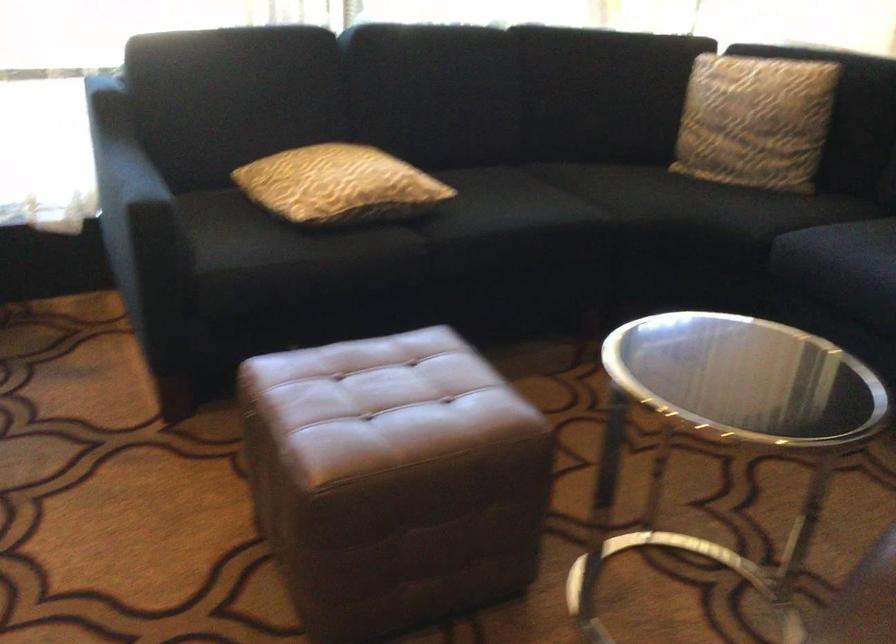
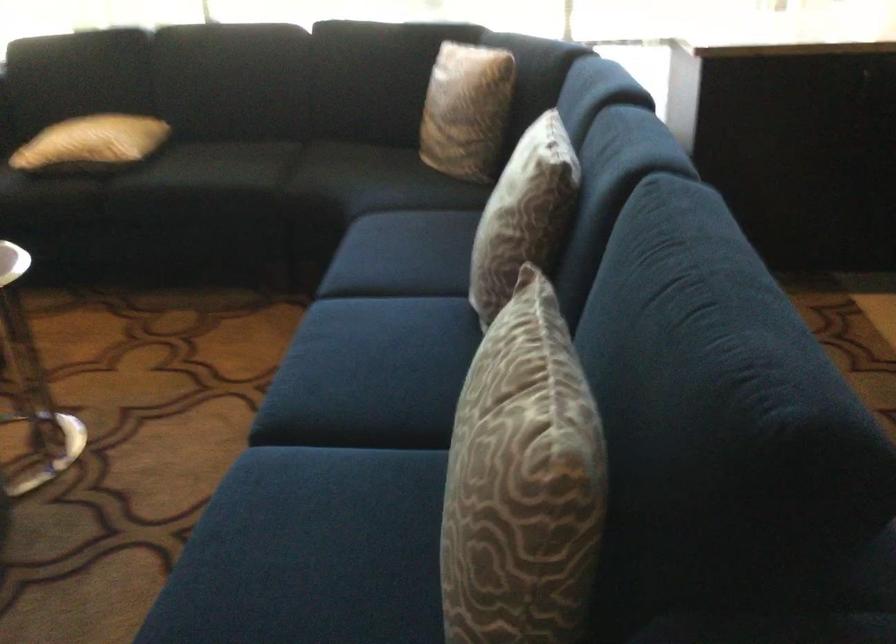
Locate, in the second image, the point that corresponds to pixel 264 86 in the first image.

(82, 64)